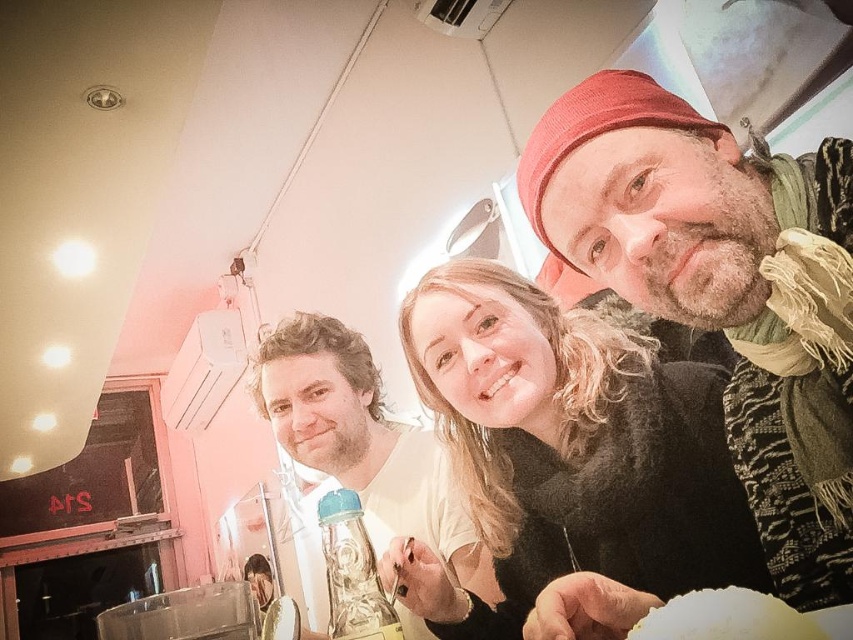
Question: Is blonde hair at center wider than knitted wool hat at upper right?

Choices:
 (A) yes
 (B) no

Answer: (A)

Question: Which point appears closest to the camera in this image?

Choices:
 (A) (375, 531)
 (B) (738, 618)
 (C) (555, 353)
 (D) (778, 584)

Answer: (B)

Question: Does blonde hair at center have a larger size compared to white matte plate at lower right?

Choices:
 (A) yes
 (B) no

Answer: (A)

Question: Which object is the closest to the knitted wool hat at upper right?

Choices:
 (A) matte white shirt at center
 (B) white matte plate at lower right

Answer: (B)

Question: Among these objects, which one is farthest from the camera?

Choices:
 (A) matte white shirt at center
 (B) knitted wool hat at upper right
 (C) white matte plate at lower right

Answer: (A)

Question: Is blonde hair at center further to the viewer compared to white matte plate at lower right?

Choices:
 (A) yes
 (B) no

Answer: (A)